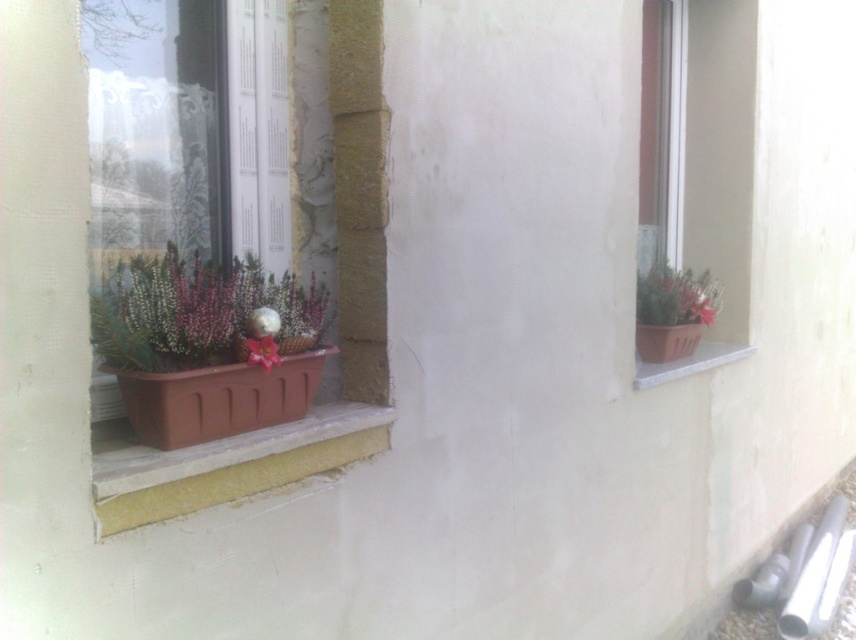
Is brown plastic container at left below matte brown pot at right?

Yes, brown plastic container at left is below matte brown pot at right.

What do you see at coordinates (360, 193) in the screenshot? This screenshot has width=856, height=640. I see `brown plastic container at left` at bounding box center [360, 193].

Identify the location of brown plastic container at left. (360, 193).

Between brown plastic flower box at left and brown plastic at right, which one is positioned higher?

brown plastic at right

From the picture: Between brown plastic flower box at left and brown plastic at right, which one is positioned lower?

brown plastic flower box at left is below.

Where is `brown plastic flower box at left`? The image size is (856, 640). brown plastic flower box at left is located at coordinates point(217,397).

Locate an element on the screen. brown plastic flower box at left is located at coordinates (217, 397).

Is matte plastic window at right wider than matte plastic pot at left?

Correct, the width of matte plastic window at right exceeds that of matte plastic pot at left.

How distant is matte plastic window at right from matte plastic pot at left?

The distance of matte plastic window at right from matte plastic pot at left is 1.91 meters.

Does point (749, 179) lie behind point (174, 317)?

Yes, it is.

This screenshot has height=640, width=856. I want to click on matte plastic window at right, so click(716, 173).